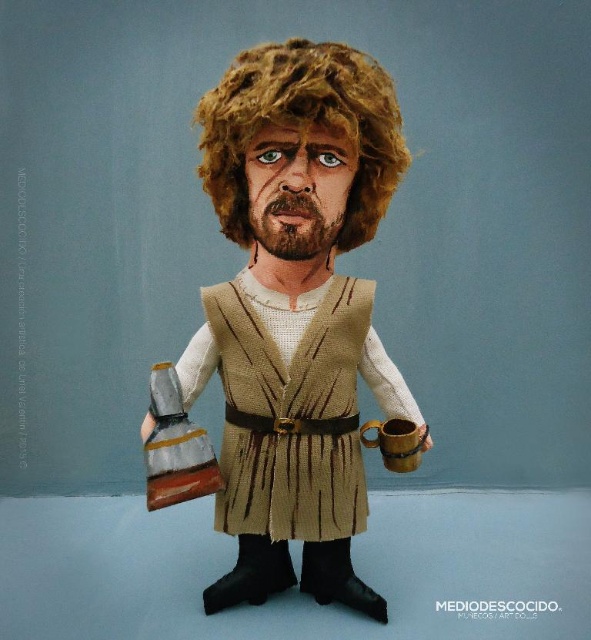
Question: Does matte brown vest at center have a greater width compared to curly blonde wig at upper center?

Choices:
 (A) no
 (B) yes

Answer: (B)

Question: Can you confirm if matte brown vest at center is positioned to the left of curly blonde wig at upper center?

Choices:
 (A) yes
 (B) no

Answer: (A)

Question: Observing the image, what is the correct spatial positioning of matte brown vest at center in reference to curly blonde wig at upper center?

Choices:
 (A) below
 (B) above

Answer: (A)

Question: Which object appears farthest from the camera in this image?

Choices:
 (A) curly blonde wig at upper center
 (B) matte brown vest at center

Answer: (B)

Question: Which of the following is the farthest from the observer?

Choices:
 (A) matte brown vest at center
 (B) curly blonde wig at upper center

Answer: (A)